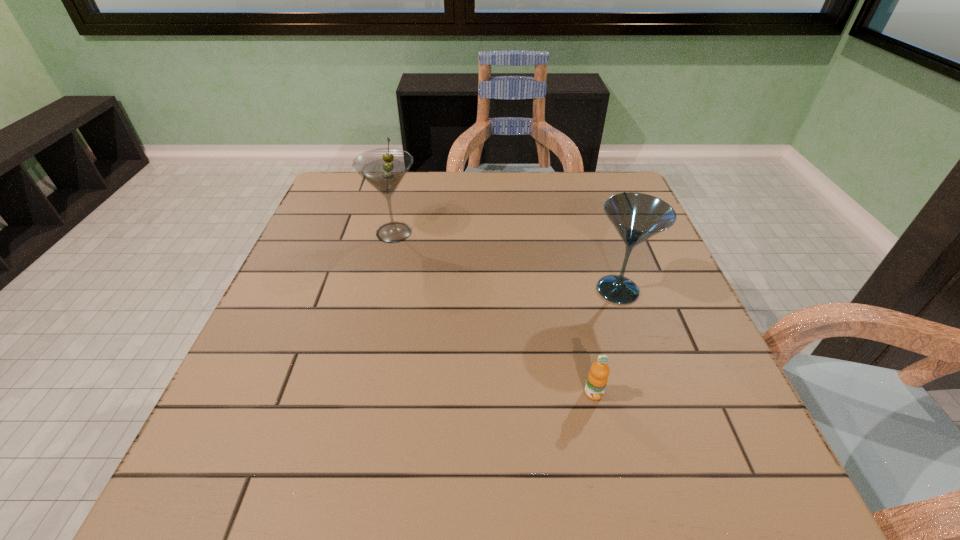
At what (x,y) coordinates should I click in order to perform the action: click on the farther martini. Please return your answer as a coordinate pair (x, y). The width and height of the screenshot is (960, 540). Looking at the image, I should click on (384, 168).

Locate an element on the screen. the leftmost object is located at coordinates (384, 168).

You are a GUI agent. You are given a task and a screenshot of the screen. Output one action in this format:
    pyautogui.click(x=<x>, y=<y>)
    Task: Click on the nearer martini
    This screenshot has height=540, width=960.
    Given the screenshot: What is the action you would take?
    pyautogui.click(x=637, y=217)

Image resolution: width=960 pixels, height=540 pixels. What are the coordinates of `the right martini` in the screenshot? It's located at (637, 217).

Identify the location of orange juice. (597, 379).

Locate an element on the screen. This screenshot has width=960, height=540. the nearest object is located at coordinates (597, 379).

Where is `vacant space located 0.230m on the back of the farther martini`? Image resolution: width=960 pixels, height=540 pixels. vacant space located 0.230m on the back of the farther martini is located at coordinates (408, 175).

What are the coordinates of `free space located on the front of the rightmost object` in the screenshot? It's located at (666, 434).

At what (x,y) coordinates should I click in order to perform the action: click on vacant space located 0.160m on the label of the orange juice. Please return your answer as a coordinate pair (x, y). The width and height of the screenshot is (960, 540). Looking at the image, I should click on (616, 495).

Locate an element on the screen. The image size is (960, 540). object present at the left edge is located at coordinates (384, 168).